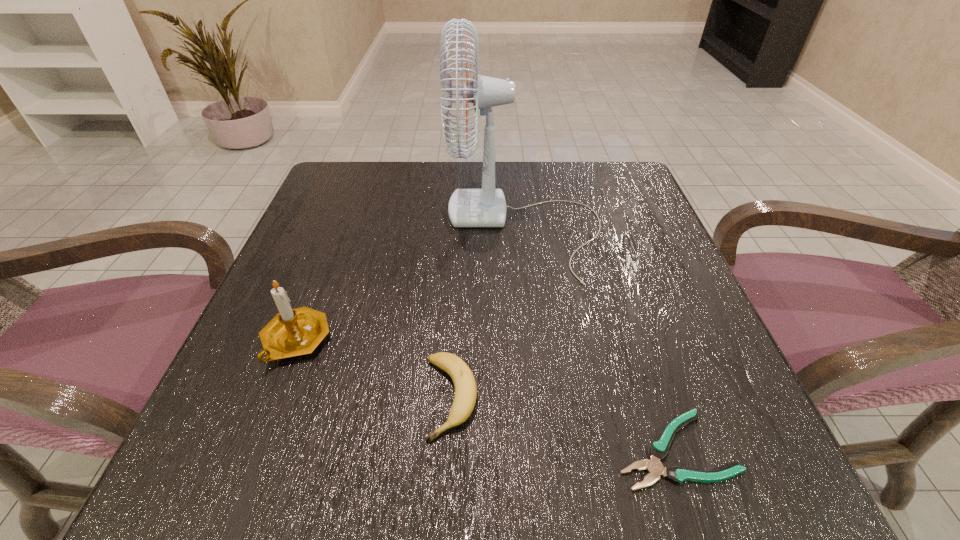
At what (x,y) coordinates should I click in order to perform the action: click on vacant space at the far edge of the desktop. Please return your answer as a coordinate pair (x, y). Looking at the image, I should click on (401, 173).

Where is `vacant space at the near edge of the desktop`? The height and width of the screenshot is (540, 960). vacant space at the near edge of the desktop is located at coordinates (372, 486).

Image resolution: width=960 pixels, height=540 pixels. In the image, there is a desktop. In order to click on free space at the left edge in this screenshot , I will do `click(345, 298)`.

Find the location of a particular element. The image size is (960, 540). vacant space at the right edge of the desktop is located at coordinates (718, 377).

In the image, there is a desktop. Where is `vacant space at the near left corner`? The height and width of the screenshot is (540, 960). vacant space at the near left corner is located at coordinates (299, 480).

This screenshot has width=960, height=540. What are the coordinates of `free region at the far right corner` in the screenshot? It's located at (641, 208).

At what (x,y) coordinates should I click in order to perform the action: click on empty space between the third tallest object and the fan. Please return your answer as a coordinate pair (x, y). Looking at the image, I should click on (488, 312).

The width and height of the screenshot is (960, 540). Identify the location of free space between the pliers and the candle holder. (485, 395).

The width and height of the screenshot is (960, 540). Find the location of `free space between the banana and the farthest object`. free space between the banana and the farthest object is located at coordinates (488, 312).

Image resolution: width=960 pixels, height=540 pixels. Find the location of `empty space between the banana and the fan`. empty space between the banana and the fan is located at coordinates pos(488,312).